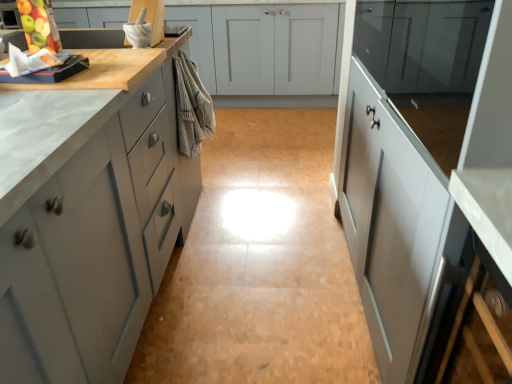
I want to click on vacant space underneath beige textured towel at center (from a real-world perspective), so click(204, 203).